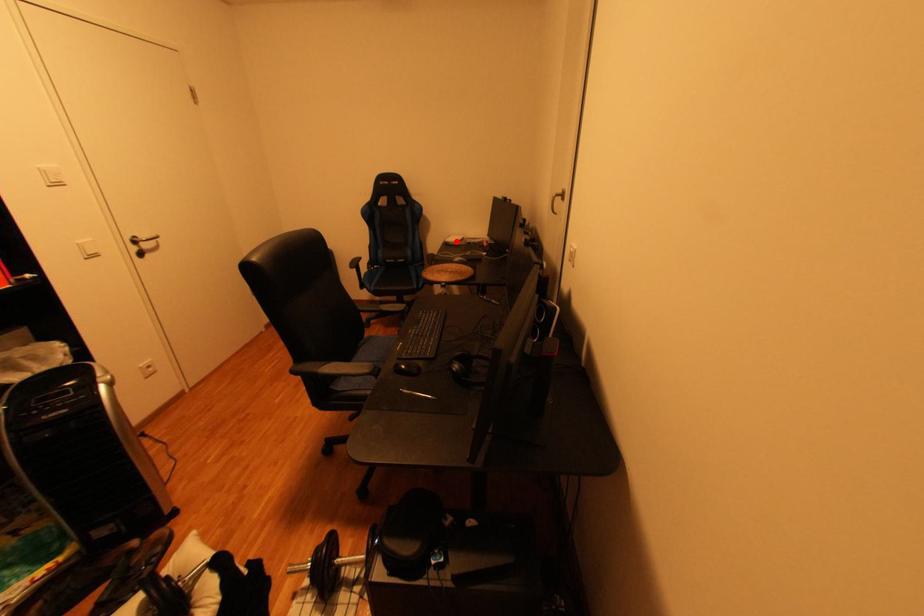
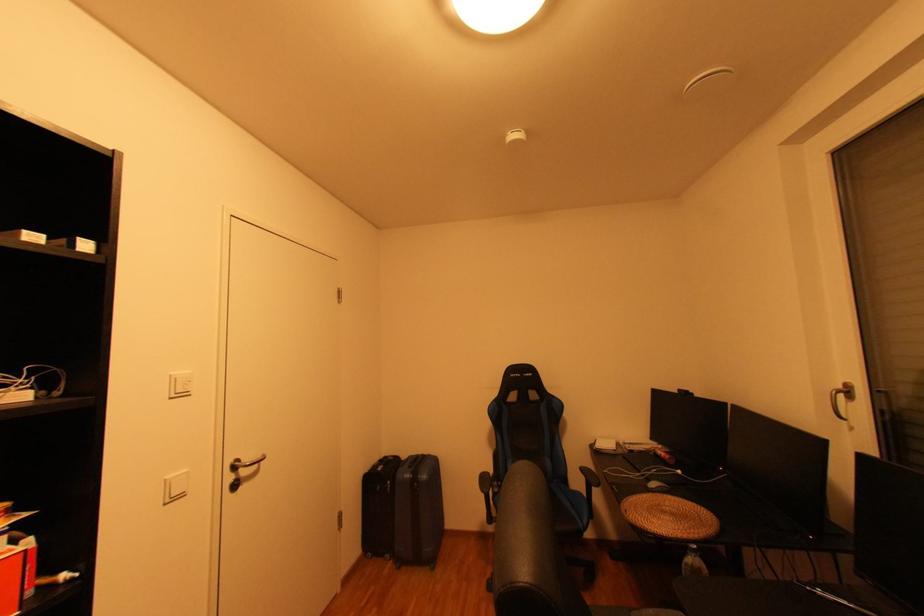
The point at the highlighted location is marked in the first image. Where is the corresponding point in the second image?

(606, 448)